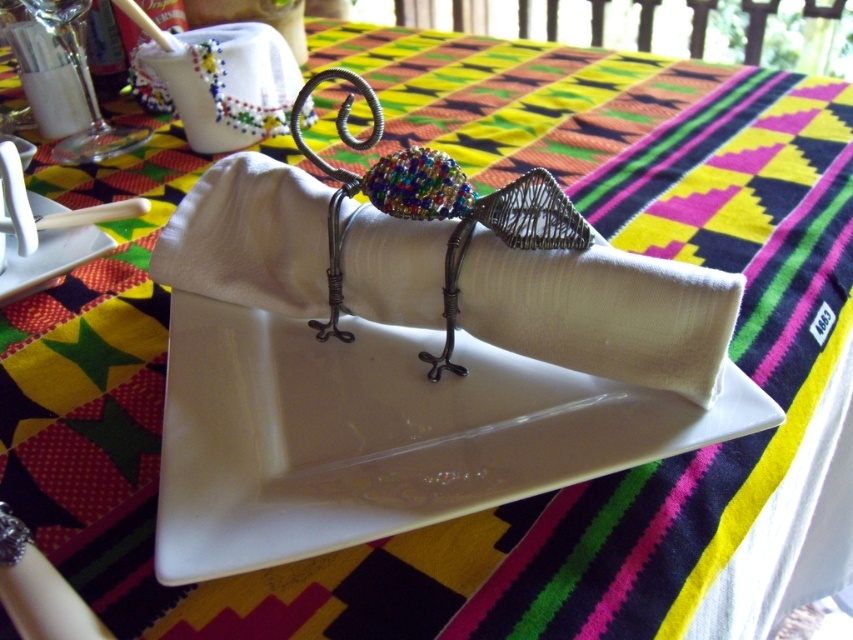
You are looking at the table setting and want to place a small decoration between the two points, point (302, 176) and point (10, 248). Which point should the decoration be closer to in order to appear larger in the image?

The decoration should be placed closer to point (302, 176) because it is closer to the camera, making objects placed there appear larger in the image.

You are a guest at a dinner table with a colorful tablecloth. You see a white fabric napkin at center and a white glossy plate at upper left. Which item is positioned closer to you?

The white fabric napkin at center is closer to the viewer than the white glossy plate at upper left.

You are a guest at a dinner party and want to place your phone between the white fabric napkin at center and the ornate wire bird napkin holder. The phone is 3 inches long. Can it fit in the space between them?

The space between the white fabric napkin at center and the ornate wire bird napkin holder is 12.34 inches. Since the phone is only 3 inches long, it can easily fit in the space between them.